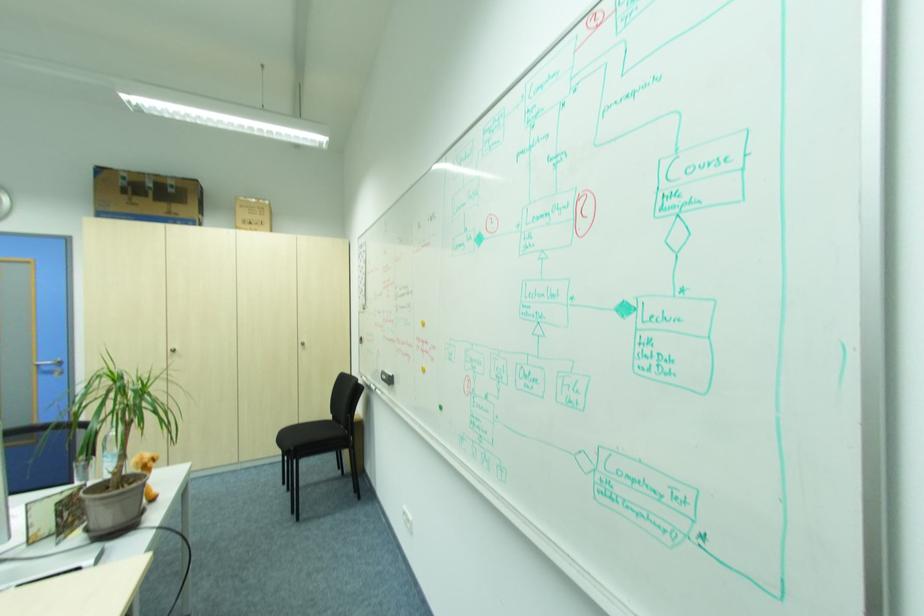
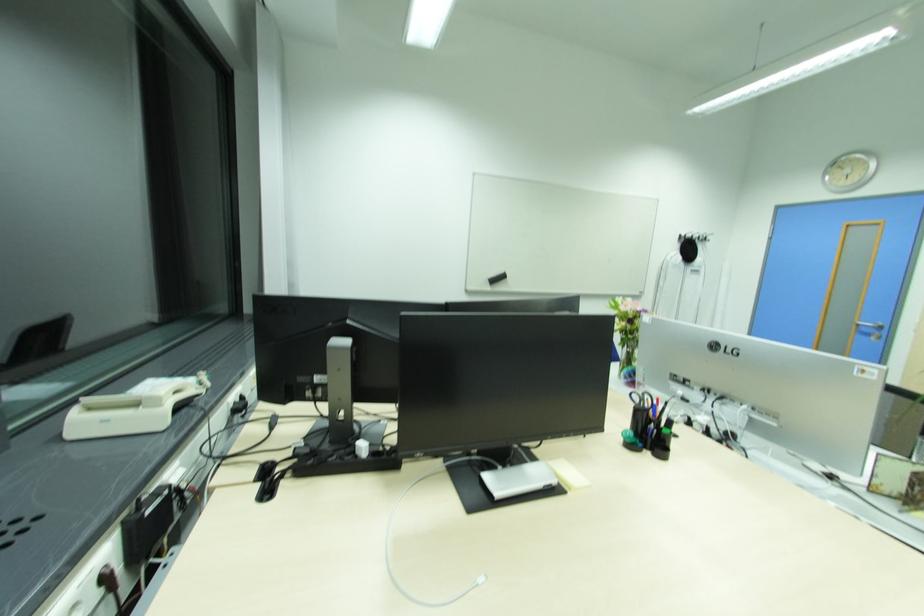
Question: I am providing you with two images of the same scene from different viewpoints. After the viewpoint changes to image2, which objects are now occluded?

Choices:
 (A) pair of scissors
 (B) yellow sticky notes
 (C) black pen
 (D) none of these

Answer: (D)